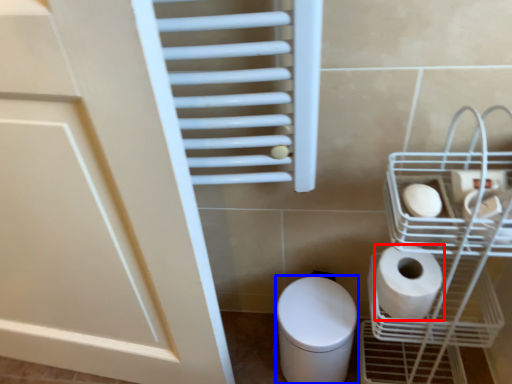
Question: Which object appears closest to the camera in this image, toilet paper (highlighted by a red box) or bidet (highlighted by a blue box)?

Choices:
 (A) toilet paper
 (B) bidet

Answer: (A)